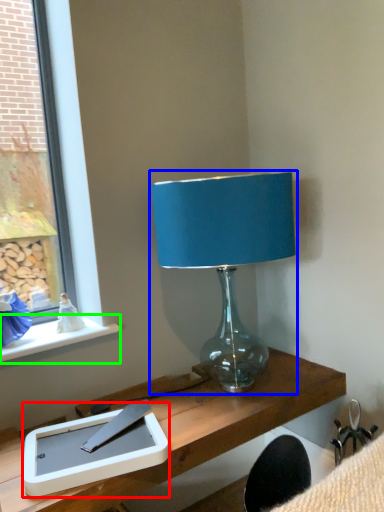
Question: Which object is positioned closest to tablet computer (highlighted by a red box)? Select from lamp (highlighted by a blue box) and window sill (highlighted by a green box).

Choices:
 (A) lamp
 (B) window sill

Answer: (B)